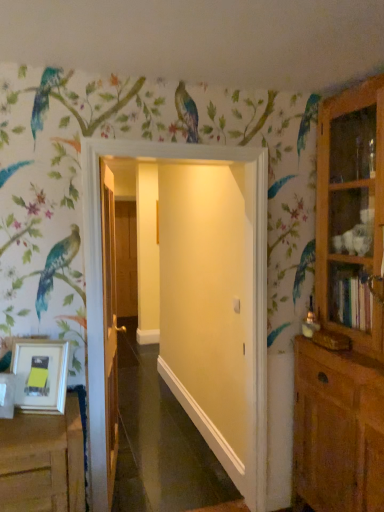
Identify the location of free space between wooden door at center, which is the 2th door in right-to-left order, and white matte door at center, the first door positioned from the right. (165, 483).